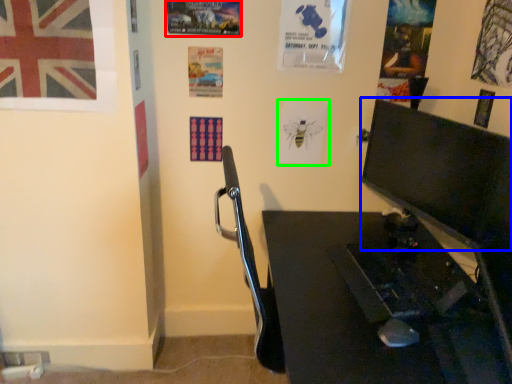
Question: Considering the real-world distances, which object is farthest from poster page (highlighted by a red box)? computer monitor (highlighted by a blue box) or poster page (highlighted by a green box)?

Choices:
 (A) computer monitor
 (B) poster page

Answer: (A)